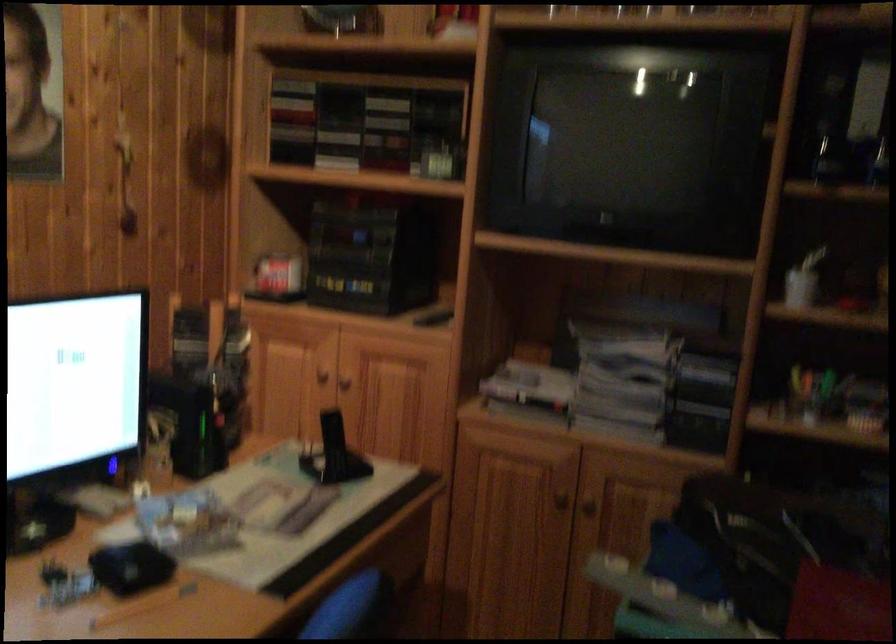
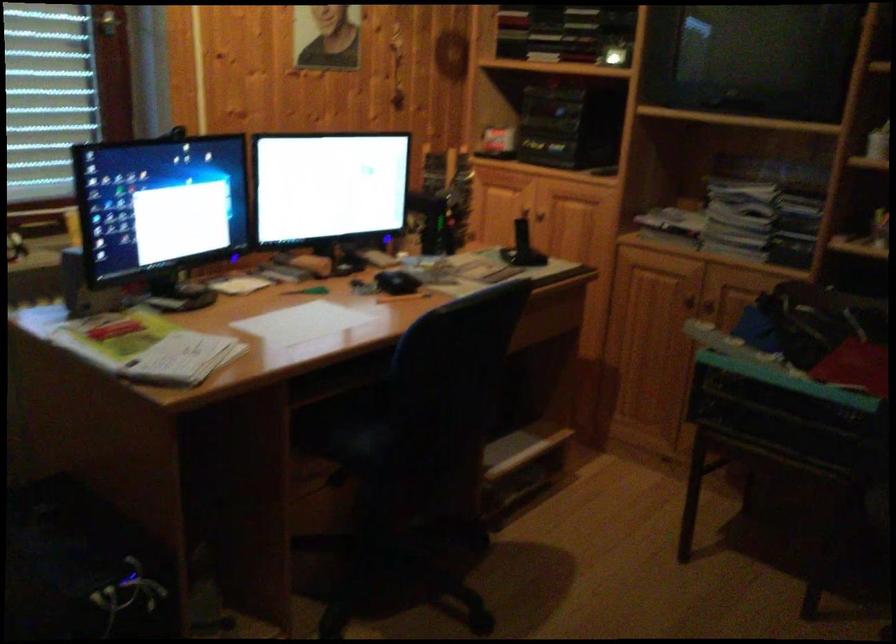
Question: The first image is from the beginning of the video and the second image is from the end. How did the camera likely rotate when shooting the video?

Choices:
 (A) Left
 (B) Right
 (C) Up
 (D) Down

Answer: (A)